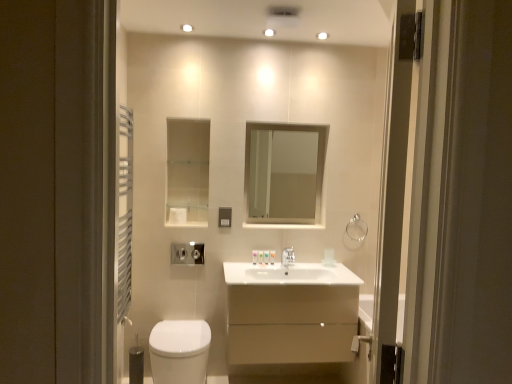
At what (x,y) coordinates should I click in order to perform the action: click on free point in front of translucent plastic soap at center, the 1th toiletry when ordered from left to right. Please return your answer as a coordinate pair (x, y). The image size is (512, 384). Looking at the image, I should click on (245, 267).